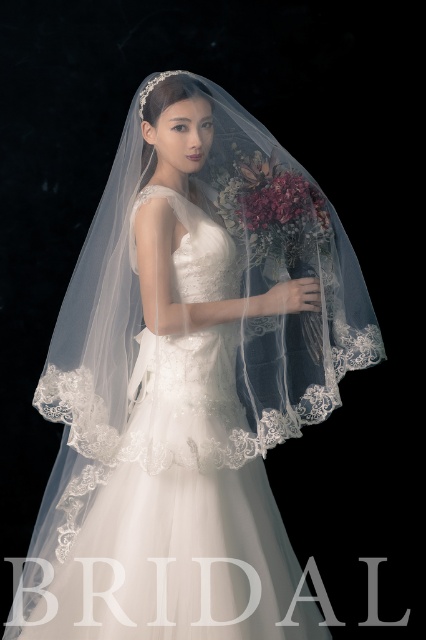
You are a photographer adjusting the camera focus. You have two points to consider for the focus lock. The first is point [193,528] and the second is point [256,230]. Which point should you choose to ensure the bride is in focus?

Point [193,528] is in front of point [256,230], so you should choose point [193,528] to ensure the bride is in focus since it is closer to the camera.

You are a photographer setting up for a wedding shoot. The bride is wearing the white lace dress at center. To ensure the dress is the focal point, where should you position your camera relative to the dress?

The white lace dress at center is located at point (158, 506), so positioning the camera directly facing this coordinate will ensure the dress remains the focal point of the image.

You are a photographer setting up for a wedding photoshoot. The bride is wearing the white lace dress at center and holding the velvet floral bouquet at center. You need to adjust the lighting so that both the dress and the bouquet are evenly illuminated. Since they are 15.55 inches apart, will you need to adjust the lights to accommodate this distance?

The white lace dress at center and velvet floral bouquet at center are 15.55 inches apart from each other, so the photographer will need to ensure the lighting covers this distance to evenly illuminate both items.